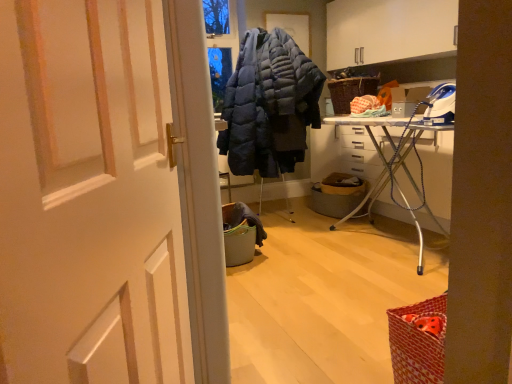
Question: Which is correct: dark blue quilted jacket at center is inside woven brown picnic basket at upper right, or outside of it?

Choices:
 (A) outside
 (B) inside

Answer: (A)

Question: Considering the positions of dark blue quilted jacket at center and woven brown picnic basket at upper right in the image, is dark blue quilted jacket at center wider or thinner than woven brown picnic basket at upper right?

Choices:
 (A) thin
 (B) wide

Answer: (B)

Question: Based on their relative distances, which object is nearer to the dark blue quilted jacket at center?

Choices:
 (A) white metal ironing board at center right
 (B) woven brown picnic basket at upper right
 (C) white matte door at center
 (D) metallic gray laundry basket at center

Answer: (D)

Question: Considering the real-world distances, which object is closest to the woven brown picnic basket at upper right?

Choices:
 (A) dark blue quilted jacket at center
 (B) white matte door at center
 (C) white metal ironing board at center right
 (D) metallic gray laundry basket at center

Answer: (D)